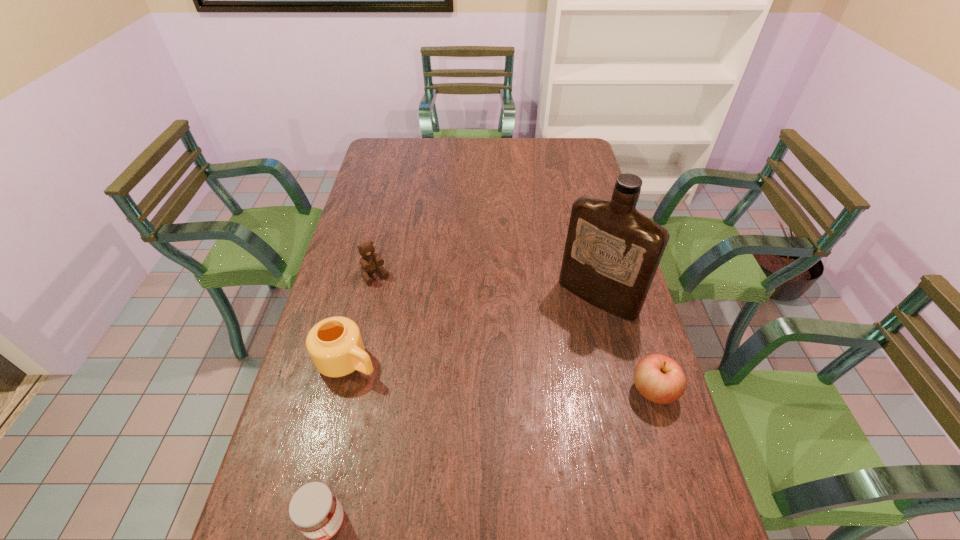
Where is `apple`? The width and height of the screenshot is (960, 540). apple is located at coordinates (660, 379).

The width and height of the screenshot is (960, 540). What are the coordinates of `the tallest object` in the screenshot? It's located at (612, 251).

Find the location of a particular element. This screenshot has height=540, width=960. mug is located at coordinates (335, 345).

The height and width of the screenshot is (540, 960). I want to click on teddy bear, so click(x=370, y=261).

Identify the location of blank area located 0.190m on the back of the apple. (630, 314).

Find the location of a particular element. Image resolution: width=960 pixels, height=540 pixels. blank area located 0.210m on the label side of the liquor is located at coordinates (540, 364).

Where is `vacant area located 0.080m on the label side of the liquor`? The image size is (960, 540). vacant area located 0.080m on the label side of the liquor is located at coordinates click(564, 334).

This screenshot has width=960, height=540. I want to click on free space located on the label side of the liquor, so click(x=523, y=386).

Find the location of `vacant space located 0.120m on the handle side of the mug`. vacant space located 0.120m on the handle side of the mug is located at coordinates (409, 393).

Where is `vacant space situated 0.170m on the handle side of the mug`? The height and width of the screenshot is (540, 960). vacant space situated 0.170m on the handle side of the mug is located at coordinates (425, 402).